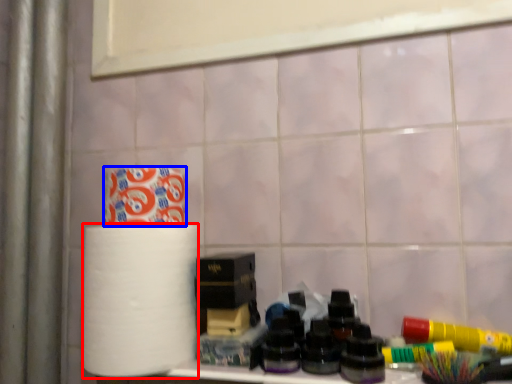
Question: Which object appears farthest to the camera in this image, paper towel (highlighted by a red box) or toilet paper (highlighted by a blue box)?

Choices:
 (A) paper towel
 (B) toilet paper

Answer: (B)